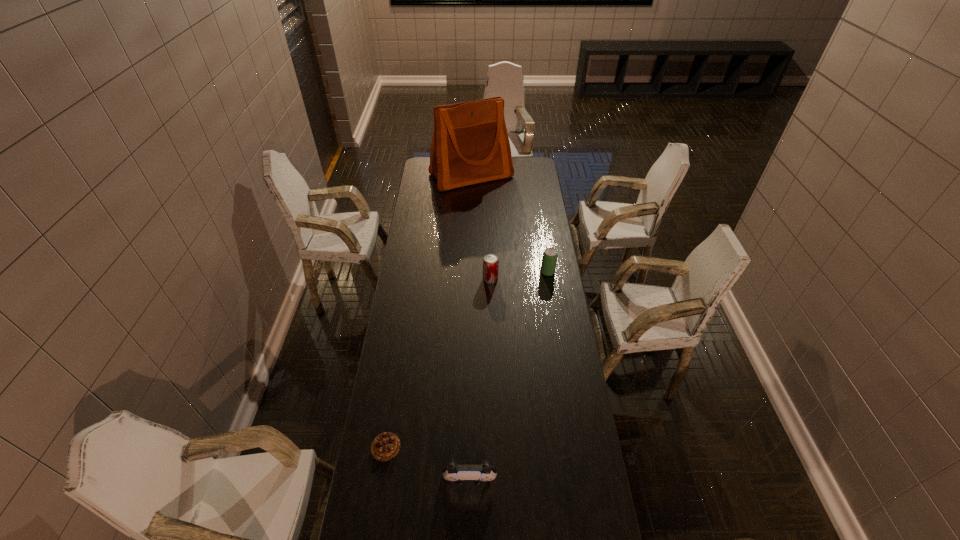
The height and width of the screenshot is (540, 960). What are the coordinates of `object that is the closest to the shopping bag` in the screenshot? It's located at (549, 259).

Locate an element on the screen. object that is the fourth closest to the left soda can is located at coordinates (x=478, y=474).